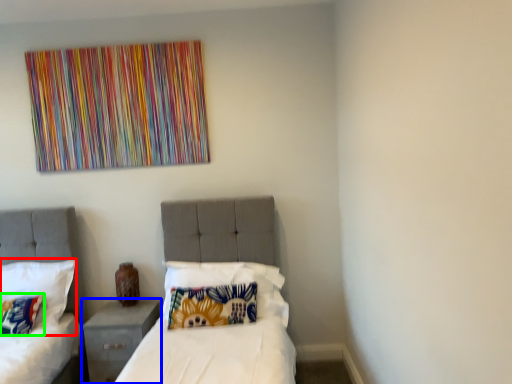
Question: Which object is positioned closest to pillow (highlighted by a red box)? Select from nightstand (highlighted by a blue box) and pillow (highlighted by a green box).

Choices:
 (A) nightstand
 (B) pillow

Answer: (B)